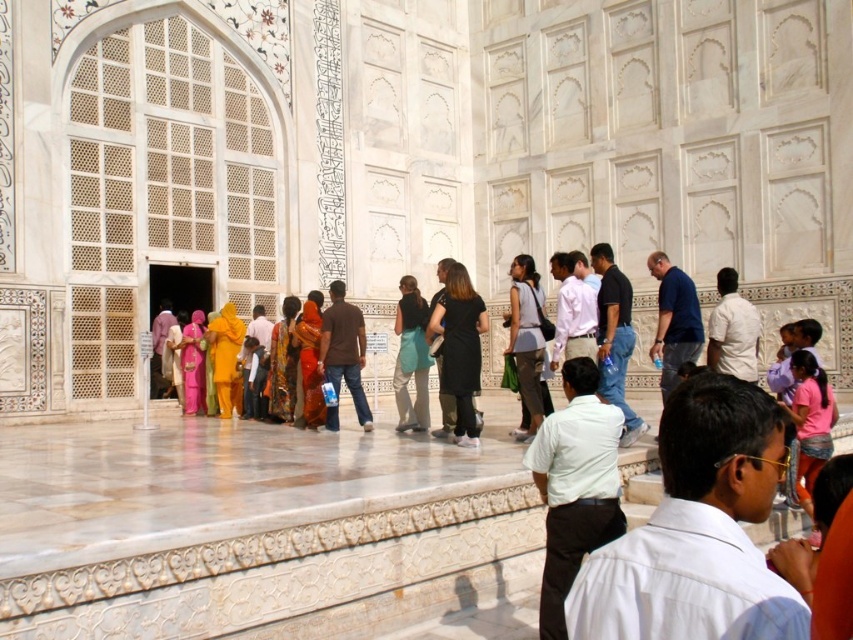
Question: Considering the relative positions of black matte dress at center and printed silk sari at center in the image provided, where is black matte dress at center located with respect to printed silk sari at center?

Choices:
 (A) left
 (B) right

Answer: (B)

Question: Where is matte gray pants at center located in relation to pink cotton shirt at lower right in the image?

Choices:
 (A) right
 (B) left

Answer: (B)

Question: Which object is positioned closest to the black matte dress at center?

Choices:
 (A) printed silk sari at center
 (B) matte gray pants at center
 (C) pink cotton shirt at lower right

Answer: (B)

Question: Where is matte gray pants at center located in relation to pink cotton shirt at lower right in the image?

Choices:
 (A) above
 (B) below

Answer: (A)

Question: Among these points, which one is farthest from the camera?

Choices:
 (A) (804, 381)
 (B) (277, 362)
 (C) (456, 301)

Answer: (B)

Question: Estimate the real-world distances between objects in this image. Which object is closer to the matte orange dress at center?

Choices:
 (A) black matte dress at center
 (B) printed silk sari at center
 (C) matte teal dress at center
 (D) matte gray pants at center

Answer: (B)